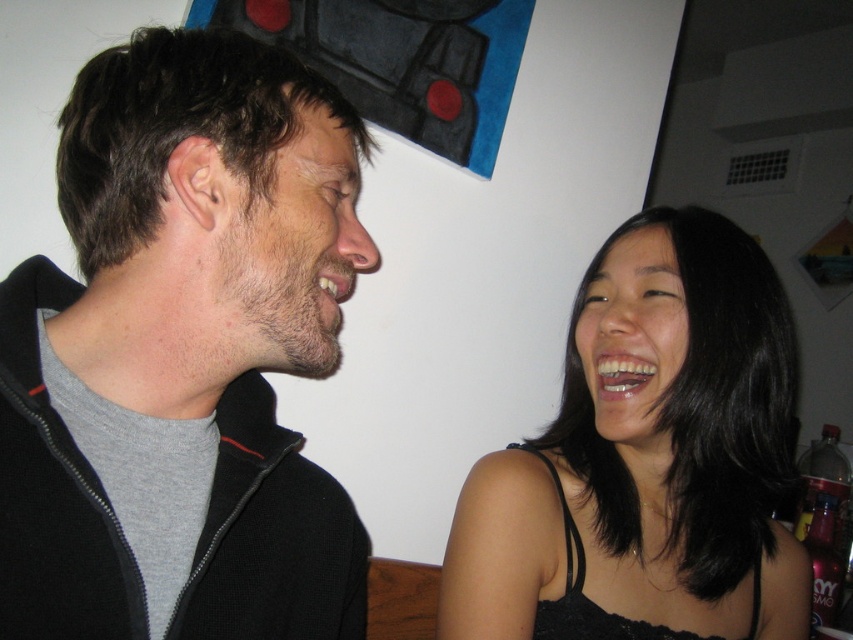
Which of these two, beige matte face at left or smooth skin face at center, stands taller?

With more height is smooth skin face at center.

Measure the distance from beige matte face at left to smooth skin face at center.

The distance of beige matte face at left from smooth skin face at center is 12.49 inches.

Is point (273, 161) more distant than point (585, 365)?

No, (273, 161) is in front of (585, 365).

Image resolution: width=853 pixels, height=640 pixels. In order to click on beige matte face at left in this screenshot , I will do `click(286, 250)`.

Is black matte jacket at left below black satin tank top at right?

Actually, black matte jacket at left is above black satin tank top at right.

Is black matte jacket at left smaller than black satin tank top at right?

Yes, black matte jacket at left is smaller than black satin tank top at right.

Between point (51, 292) and point (701, 625), which one is positioned behind?

The point (701, 625) is more distant.

Where is `black matte jacket at left`? black matte jacket at left is located at coordinates (183, 355).

Is black matte jacket at left to the left of beige matte face at left from the viewer's perspective?

Correct, you'll find black matte jacket at left to the left of beige matte face at left.

Which of these two, black matte jacket at left or beige matte face at left, stands shorter?

With less height is beige matte face at left.

Does point (280, 486) lie in front of point (264, 243)?

No, it is behind (264, 243).

At what (x,y) coordinates should I click in order to perform the action: click on black matte jacket at left. Please return your answer as a coordinate pair (x, y). This screenshot has width=853, height=640. Looking at the image, I should click on tap(183, 355).